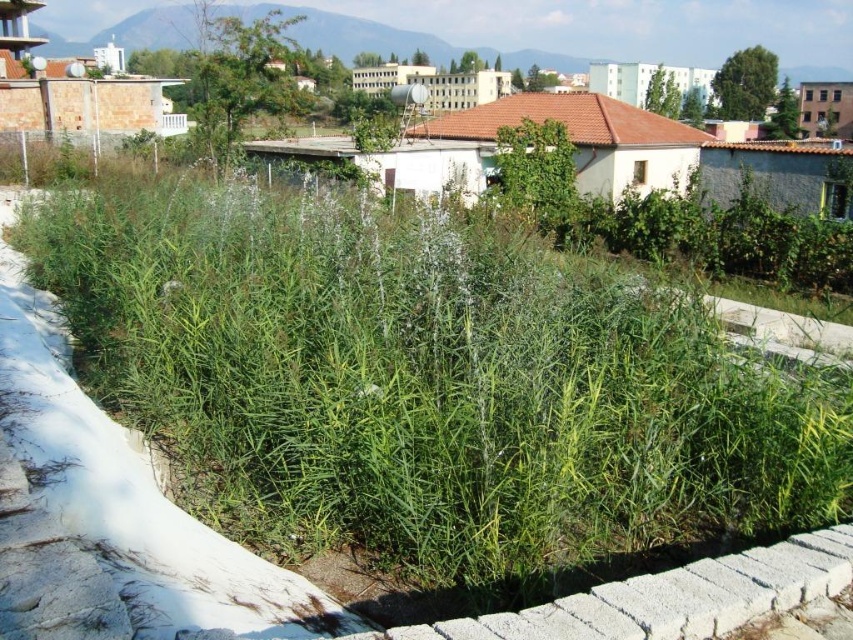
Question: Among these objects, which one is farthest from the camera?

Choices:
 (A) green grass at upper center
 (B) green leafy grass at center

Answer: (A)

Question: Is green leafy grass at center in front of green grass at upper center?

Choices:
 (A) yes
 (B) no

Answer: (A)

Question: Among these points, which one is nearest to the camera?

Choices:
 (A) (346, 22)
 (B) (345, 282)

Answer: (B)

Question: Does green leafy grass at center have a lesser width compared to green grass at upper center?

Choices:
 (A) no
 (B) yes

Answer: (B)

Question: Is green leafy grass at center to the left of green grass at upper center from the viewer's perspective?

Choices:
 (A) yes
 (B) no

Answer: (B)